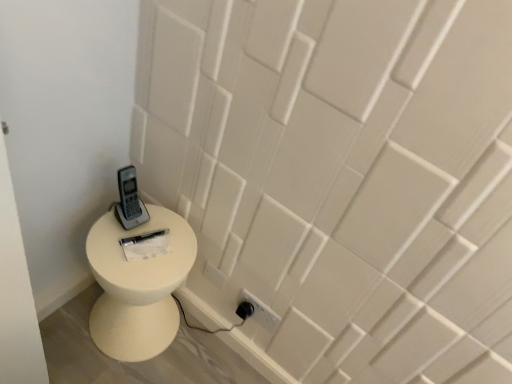
Identify the location of spots to the right of gray plastic phone at upper left. Image resolution: width=512 pixels, height=384 pixels. (167, 234).